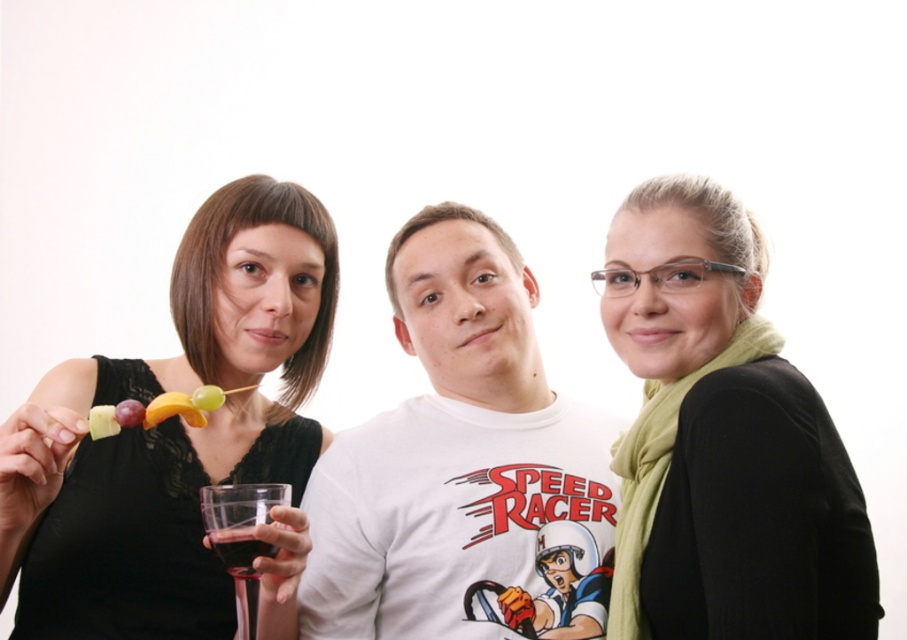
Question: Does matte plastic skewer with fruit at left appear under yellow matte pineapple at center?

Choices:
 (A) no
 (B) yes

Answer: (A)

Question: Which point is farther from the camera taking this photo?

Choices:
 (A) (116, 422)
 (B) (547, 573)
 (C) (174, 392)

Answer: (B)

Question: Which point appears closest to the camera in this image?

Choices:
 (A) (129, 408)
 (B) (584, 556)
 (C) (703, 568)
 (D) (147, 426)

Answer: (C)

Question: Which object is closer to the camera taking this photo?

Choices:
 (A) green scarf at center
 (B) white glossy helmet at center
 (C) black lace dress at upper left

Answer: (A)

Question: In this image, where is green scarf at center located relative to transparent glass at center?

Choices:
 (A) right
 (B) left

Answer: (A)

Question: Does yellow matte pineapple at center have a smaller size compared to purple matte grape at upper left?

Choices:
 (A) yes
 (B) no

Answer: (B)